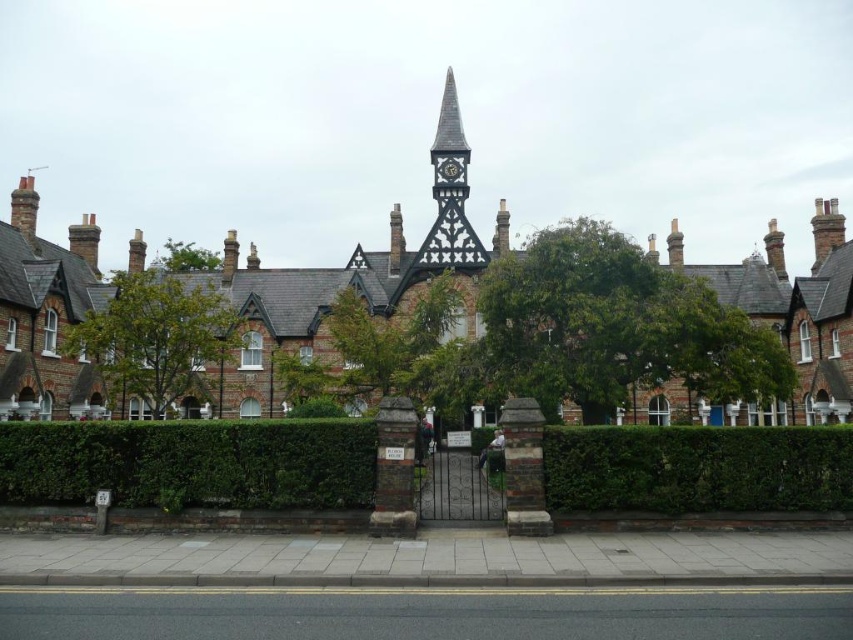
You are a landscape architect designing a new garden around the historic building. You need to ensure that the green leafy tree at upper center and the metallic clock at upper center are visible from the main pathway. Considering their widths, which object might require more space to maintain visibility?

The green leafy tree at upper center requires more space because its width surpasses that of the metallic clock at upper center, so it needs a wider area to maintain visibility.

You are a visitor approaching the historic building and notice both the green leafy tree at upper center and the metallic clock at upper center. Which object would block your view of the other when looking from the front entrance?

The green leafy tree at upper center is in front of the metallic clock at upper center, so the tree would block the view of the clock when looking from the front entrance.

You are standing in front of the historic building and want to take a photo of the green leafy hedge at center and the green leafy tree at upper center. Which object should you focus on first if you want to capture both in the frame without moving the camera?

You should focus on the green leafy tree at upper center first because the green leafy hedge at center is positioned to its right, so framing the tree first ensures both are included in the shot.